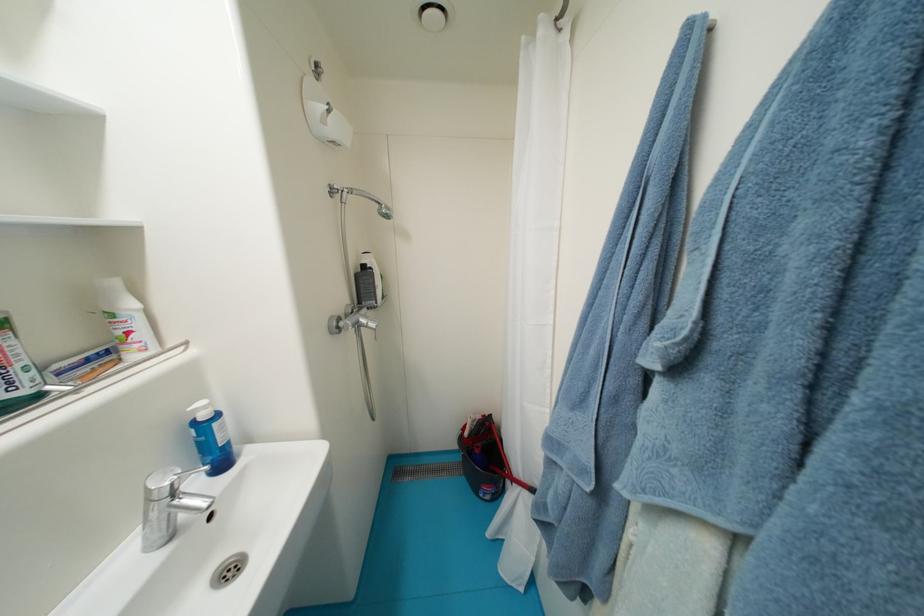
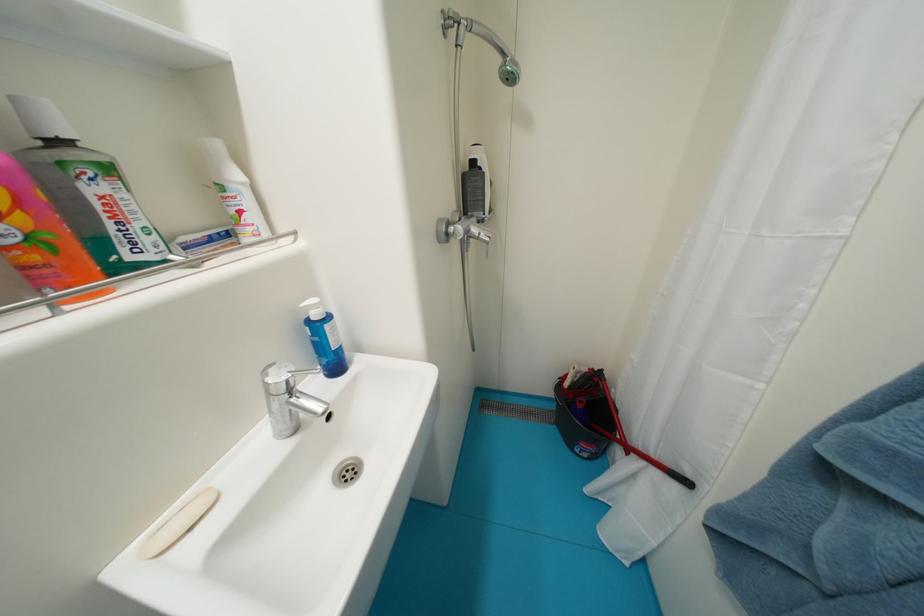
Question: The first image is from the beginning of the video and the second image is from the end. How did the camera likely rotate when shooting the video?

Choices:
 (A) Left
 (B) Right
 (C) Up
 (D) Down

Answer: (A)